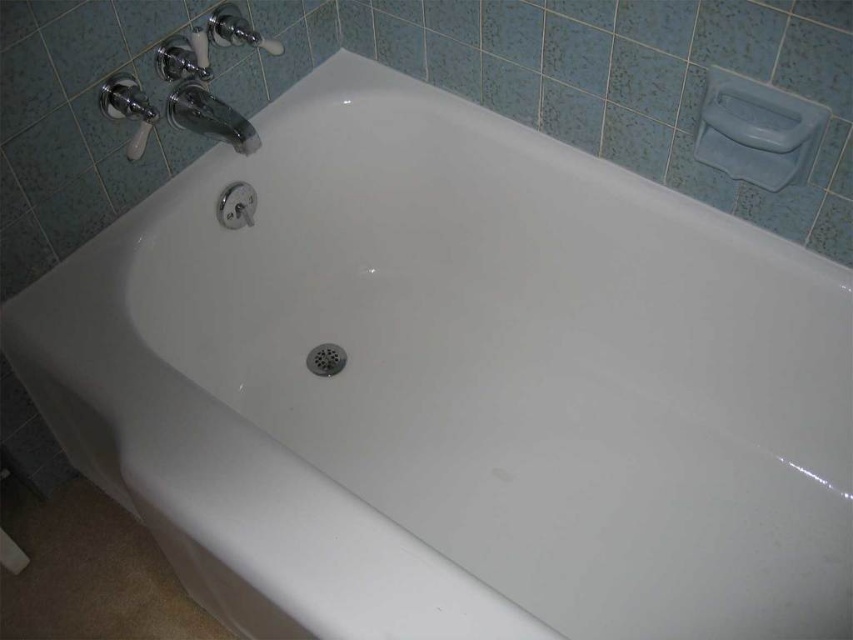
Which is below, chrome metallic faucet at upper left or metallic silver drain at center?

metallic silver drain at center is below.

Does chrome metallic faucet at upper left come in front of metallic silver drain at center?

Yes.

You are a GUI agent. You are given a task and a screenshot of the screen. Output one action in this format:
    pyautogui.click(x=<x>, y=<y>)
    Task: Click on the chrome metallic faucet at upper left
    
    Given the screenshot: What is the action you would take?
    pyautogui.click(x=209, y=116)